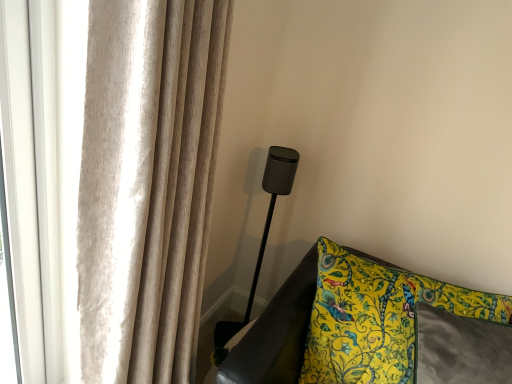
Question: From the image's perspective, is matte black speaker at center positioned above or below beige textured curtain at upper left?

Choices:
 (A) below
 (B) above

Answer: (B)

Question: Is matte black speaker at center taller or shorter than beige textured curtain at upper left?

Choices:
 (A) short
 (B) tall

Answer: (A)

Question: Based on their relative distances, which object is farther from the beige textured curtain at upper left?

Choices:
 (A) yellow floral fabric cushion at lower right
 (B) matte black speaker at center

Answer: (B)

Question: Considering the real-world distances, which object is closest to the beige textured curtain at upper left?

Choices:
 (A) yellow floral fabric cushion at lower right
 (B) matte black speaker at center

Answer: (A)